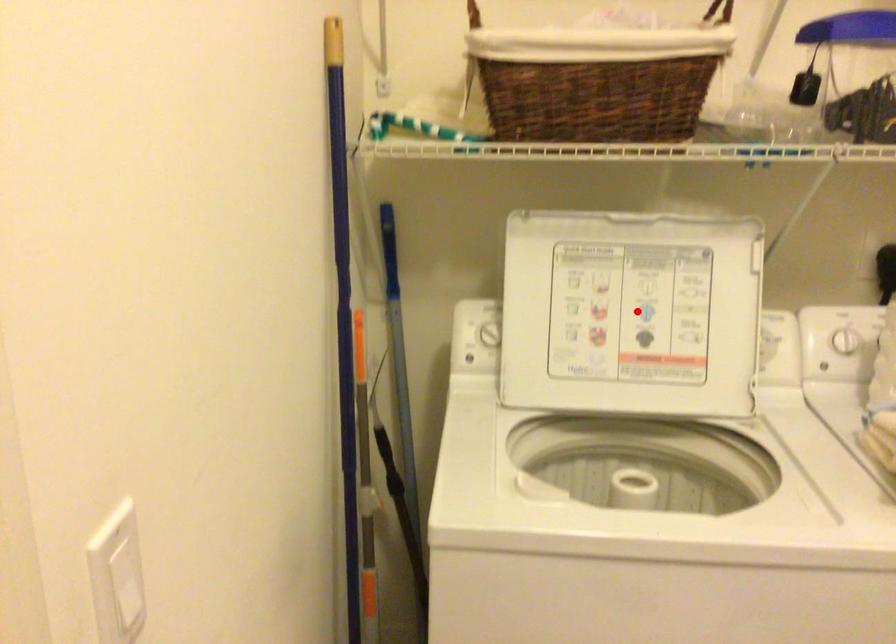
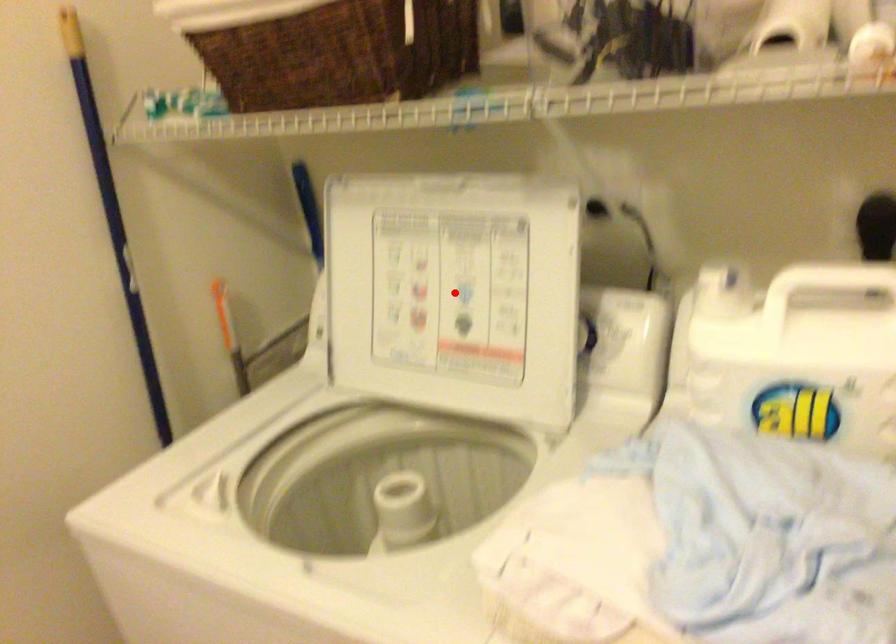
I am providing you with two images of the same scene from different viewpoints. A red point is marked on the first image and another point is marked on the second image. Do the highlighted points in image1 and image2 indicate the same real-world spot?

Yes